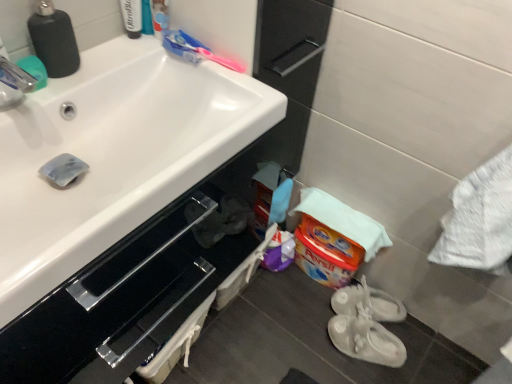
Question: Is white rubber shoes at lower right, which ranks as the 1th footwear in front-to-back order, a part of white glossy sink at upper left?

Choices:
 (A) no
 (B) yes

Answer: (A)

Question: Considering the relative sizes of white glossy sink at upper left and white rubber shoes at lower right, which ranks as the 1th footwear in front-to-back order, in the image provided, is white glossy sink at upper left bigger than white rubber shoes at lower right, which ranks as the 1th footwear in front-to-back order,?

Choices:
 (A) no
 (B) yes

Answer: (B)

Question: From the image's perspective, is white glossy sink at upper left beneath white rubber shoes at lower right, which ranks as the 1th footwear in front-to-back order?

Choices:
 (A) yes
 (B) no

Answer: (B)

Question: Considering the relative positions of white glossy sink at upper left and white rubber shoes at lower right, which ranks as the 1th footwear in front-to-back order, in the image provided, is white glossy sink at upper left to the left of white rubber shoes at lower right, which ranks as the 1th footwear in front-to-back order, from the viewer's perspective?

Choices:
 (A) no
 (B) yes

Answer: (B)

Question: Considering the relative sizes of white glossy sink at upper left and white rubber shoes at lower right, which is the 2th footwear from back to front, in the image provided, is white glossy sink at upper left thinner than white rubber shoes at lower right, which is the 2th footwear from back to front,?

Choices:
 (A) no
 (B) yes

Answer: (A)

Question: From a real-world perspective, does white glossy sink at upper left sit lower than white rubber shoes at lower right, which ranks as the 1th footwear in front-to-back order?

Choices:
 (A) no
 (B) yes

Answer: (A)

Question: Does white rubber shoes at lower right, positioned as the 1th footwear in back-to-front order, have a lesser width compared to black glossy cabinet at lower left?

Choices:
 (A) no
 (B) yes

Answer: (B)

Question: Considering the relative sizes of white rubber shoes at lower right, positioned as the 1th footwear in back-to-front order, and black glossy cabinet at lower left in the image provided, is white rubber shoes at lower right, positioned as the 1th footwear in back-to-front order, shorter than black glossy cabinet at lower left?

Choices:
 (A) yes
 (B) no

Answer: (A)

Question: From a real-world perspective, is white rubber shoes at lower right, the 2th footwear positioned from the front, on black glossy cabinet at lower left?

Choices:
 (A) yes
 (B) no

Answer: (B)

Question: Could you tell me if white rubber shoes at lower right, the 2th footwear positioned from the front, is facing black glossy cabinet at lower left?

Choices:
 (A) no
 (B) yes

Answer: (A)

Question: Is white rubber shoes at lower right, the 2th footwear positioned from the front, oriented away from black glossy cabinet at lower left?

Choices:
 (A) no
 (B) yes

Answer: (A)

Question: Does white rubber shoes at lower right, the 2th footwear positioned from the front, have a greater height compared to black glossy cabinet at lower left?

Choices:
 (A) no
 (B) yes

Answer: (A)

Question: Considering the relative sizes of white glossy sink at upper left and translucent plastic toothbrush at upper center, positioned as the second toiletry in left-to-right order, in the image provided, is white glossy sink at upper left taller than translucent plastic toothbrush at upper center, positioned as the second toiletry in left-to-right order,?

Choices:
 (A) yes
 (B) no

Answer: (A)